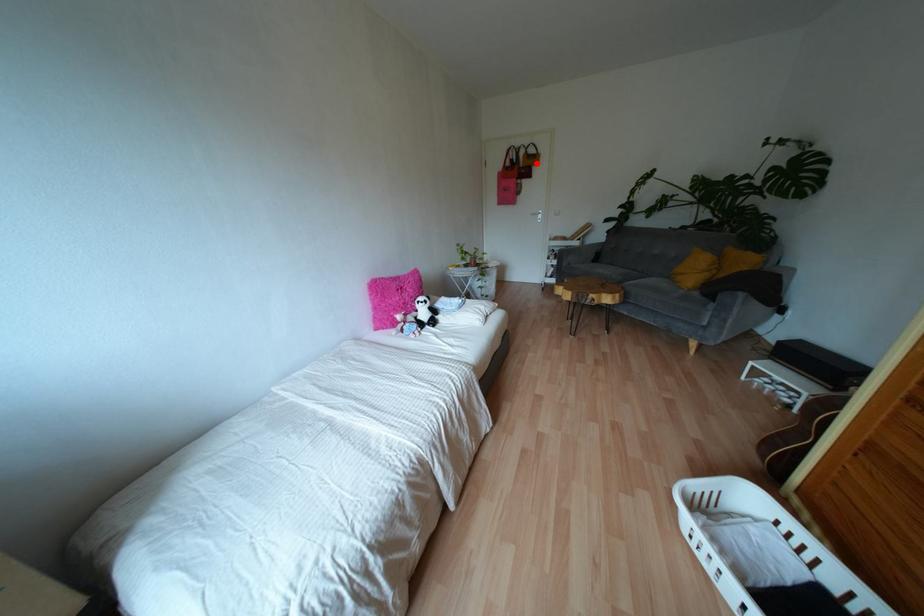
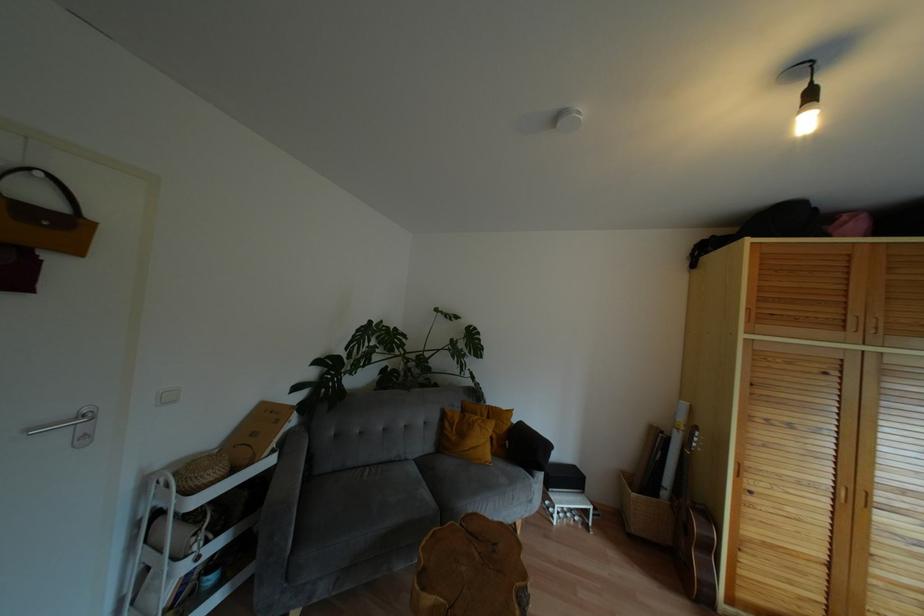
Find the pixel in the second image that matches the highlighted location in the first image.

(78, 251)